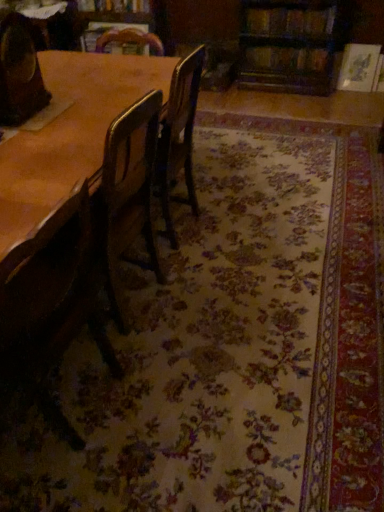
Question: Is the position of wooden chair at left, acting as the 2th chair starting from the top, more distant than that of wooden chair at left, which is the first chair in top-to-bottom order?

Choices:
 (A) yes
 (B) no

Answer: (B)

Question: Considering the relative sizes of wooden chair at left, acting as the 2th chair starting from the top, and wooden chair at left, which is the first chair in top-to-bottom order, in the image provided, is wooden chair at left, acting as the 2th chair starting from the top, taller than wooden chair at left, which is the first chair in top-to-bottom order,?

Choices:
 (A) no
 (B) yes

Answer: (B)

Question: Can you confirm if wooden chair at left, acting as the 2th chair starting from the top, is shorter than wooden chair at left, which is the first chair in top-to-bottom order?

Choices:
 (A) yes
 (B) no

Answer: (B)

Question: From the image's perspective, is wooden chair at left, acting as the 2th chair starting from the top, above wooden chair at left, which is the second chair in bottom-to-top order?

Choices:
 (A) no
 (B) yes

Answer: (A)

Question: Considering the relative positions of wooden chair at left, acting as the 2th chair starting from the top, and wooden chair at left, which is the first chair in top-to-bottom order, in the image provided, is wooden chair at left, acting as the 2th chair starting from the top, to the right of wooden chair at left, which is the first chair in top-to-bottom order, from the viewer's perspective?

Choices:
 (A) no
 (B) yes

Answer: (B)

Question: In terms of size, does wooden chair at left, acting as the 2th chair starting from the top, appear bigger or smaller than hardcover book at upper center, the second book positioned from the bottom?

Choices:
 (A) big
 (B) small

Answer: (A)

Question: Considering their positions, is wooden chair at left, positioned as the 1th chair in bottom-to-top order, located in front of or behind hardcover book at upper center, the 2th book positioned from the left?

Choices:
 (A) behind
 (B) front

Answer: (B)

Question: Is point (57, 284) closer or farther from the camera than point (251, 13)?

Choices:
 (A) closer
 (B) farther

Answer: (A)

Question: From a real-world perspective, is wooden chair at left, acting as the 2th chair starting from the top, positioned above or below hardcover book at upper center, the 2th book positioned from the left?

Choices:
 (A) above
 (B) below

Answer: (B)

Question: From a real-world perspective, is wooden chair at left, which is the second chair in bottom-to-top order, positioned above or below hardcover book at upper center, which is counted as the second book, starting from the right?

Choices:
 (A) above
 (B) below

Answer: (A)

Question: Do you think wooden chair at left, which is the second chair in bottom-to-top order, is within hardcover book at upper center, which is counted as the second book, starting from the right, or outside of it?

Choices:
 (A) outside
 (B) inside

Answer: (A)

Question: Is wooden chair at left, which is the second chair in bottom-to-top order, wider or thinner than hardcover book at upper center, the 2th book positioned from the left?

Choices:
 (A) thin
 (B) wide

Answer: (A)

Question: In terms of height, does wooden chair at left, which is the second chair in bottom-to-top order, look taller or shorter compared to hardcover book at upper center, the second book positioned from the bottom?

Choices:
 (A) tall
 (B) short

Answer: (A)

Question: Would you say hardcover book at upper right, the first book in the right-to-left sequence, is inside or outside hardcover book at upper center, the first book positioned from the top?

Choices:
 (A) inside
 (B) outside

Answer: (B)

Question: Considering the positions of hardcover book at upper right, placed as the 3th book when sorted from top to bottom, and hardcover book at upper center, marked as the 3th book in a bottom-to-top arrangement, in the image, is hardcover book at upper right, placed as the 3th book when sorted from top to bottom, wider or thinner than hardcover book at upper center, marked as the 3th book in a bottom-to-top arrangement,?

Choices:
 (A) thin
 (B) wide

Answer: (A)